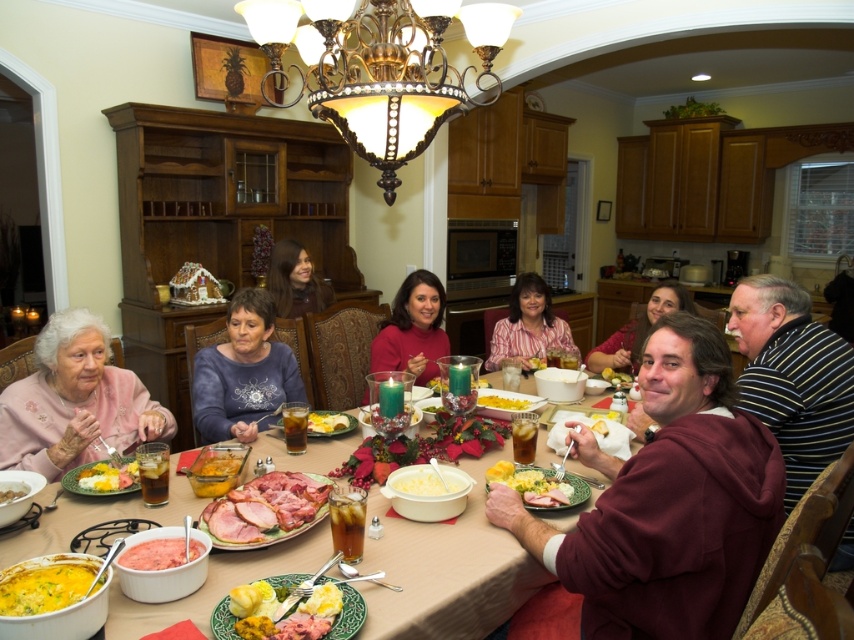
You are a guest at this holiday gathering and need to sit down. You see the striped shirt at center and the maroon fleece jacket at lower right. Which of these two items takes up more space in the scene?

The maroon fleece jacket at lower right takes up more space than the striped shirt at center.